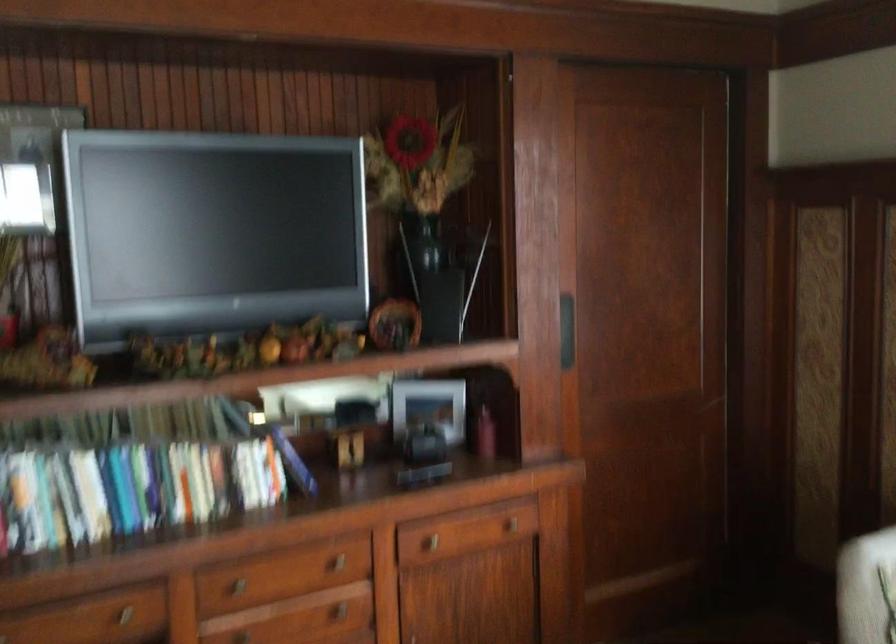
Find where to slid the black door handle. Please return your answer as a coordinate pair (x, y).

(565, 330)